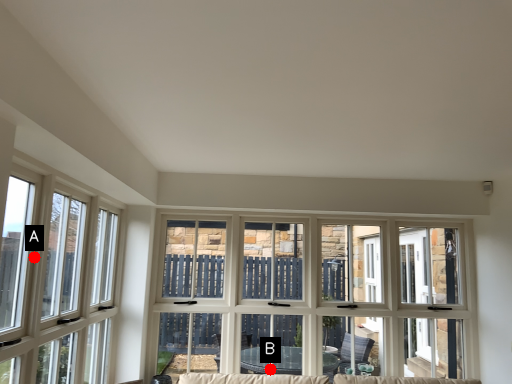
Question: Two points are circled on the image, labeled by A and B beside each circle. Which of the following is the closest to the observer?

Choices:
 (A) A is closer
 (B) B is closer

Answer: (A)